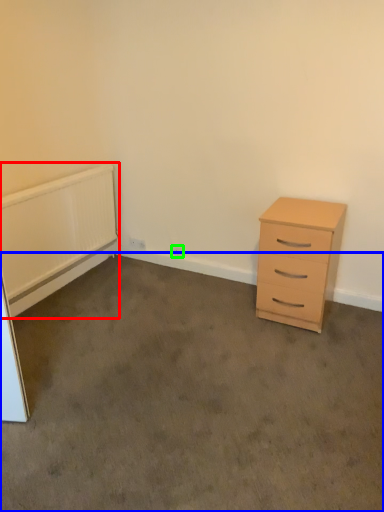
Question: Considering the real-world distances, which object is farthest from radiator (highlighted by a red box)? plain (highlighted by a blue box) or electric outlet (highlighted by a green box)?

Choices:
 (A) plain
 (B) electric outlet

Answer: (B)